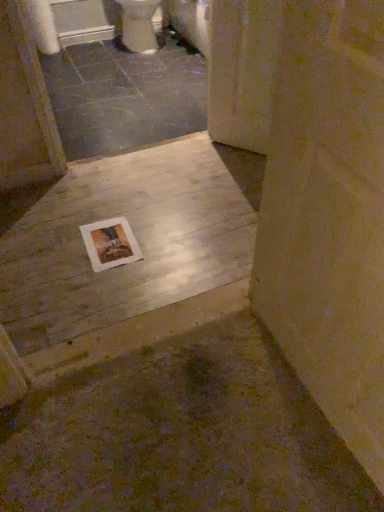
Question: Is wooden floor at center, the 2th concrete viewed from the top, positioned in front of white glossy toilet at upper center?

Choices:
 (A) yes
 (B) no

Answer: (A)

Question: Considering the relative positions of wooden floor at center, which is the 1th concrete in front-to-back order, and white glossy toilet at upper center in the image provided, is wooden floor at center, which is the 1th concrete in front-to-back order, to the left of white glossy toilet at upper center from the viewer's perspective?

Choices:
 (A) no
 (B) yes

Answer: (A)

Question: Is wooden floor at center, the 1th concrete from the bottom, at the right side of white glossy toilet at upper center?

Choices:
 (A) no
 (B) yes

Answer: (B)

Question: Does wooden floor at center, the 2th concrete viewed from the top, have a lesser width compared to white glossy toilet at upper center?

Choices:
 (A) yes
 (B) no

Answer: (B)

Question: Considering the relative sizes of wooden floor at center, which is the 2th concrete in back-to-front order, and white glossy toilet at upper center in the image provided, is wooden floor at center, which is the 2th concrete in back-to-front order, bigger than white glossy toilet at upper center?

Choices:
 (A) yes
 (B) no

Answer: (B)

Question: Considering the positions of wooden floor at center, the 1th concrete from the bottom, and white paper at upper left in the image, is wooden floor at center, the 1th concrete from the bottom, wider or thinner than white paper at upper left?

Choices:
 (A) wide
 (B) thin

Answer: (A)

Question: Considering the positions of point (178, 202) and point (46, 6), is point (178, 202) closer or farther from the camera than point (46, 6)?

Choices:
 (A) farther
 (B) closer

Answer: (B)

Question: In the image, is wooden floor at center, which is the 1th concrete in front-to-back order, positioned in front of or behind white paper at upper left?

Choices:
 (A) behind
 (B) front

Answer: (B)

Question: Is wooden floor at center, which is the 2th concrete in back-to-front order, taller or shorter than white paper at upper left?

Choices:
 (A) short
 (B) tall

Answer: (A)

Question: Is smooth gray concrete at center, which appears as the 1th concrete when viewed from the back, bigger or smaller than wooden floor at center, which is the 1th concrete in front-to-back order?

Choices:
 (A) small
 (B) big

Answer: (B)

Question: From their relative heights in the image, would you say smooth gray concrete at center, which is the 2th concrete in bottom-to-top order, is taller or shorter than wooden floor at center, the 1th concrete from the bottom?

Choices:
 (A) tall
 (B) short

Answer: (B)

Question: Would you say smooth gray concrete at center, the 1th concrete when ordered from top to bottom, is inside or outside wooden floor at center, the 2th concrete viewed from the top?

Choices:
 (A) inside
 (B) outside

Answer: (B)

Question: Considering the positions of point (203, 72) and point (124, 198), is point (203, 72) closer or farther from the camera than point (124, 198)?

Choices:
 (A) farther
 (B) closer

Answer: (A)

Question: From a real-world perspective, relative to wooden floor at center, which is the 2th concrete in back-to-front order, is white glossy toilet at upper center vertically above or below?

Choices:
 (A) below
 (B) above

Answer: (B)

Question: Based on their positions, is white glossy toilet at upper center located to the left or right of wooden floor at center, the 1th concrete from the bottom?

Choices:
 (A) left
 (B) right

Answer: (A)